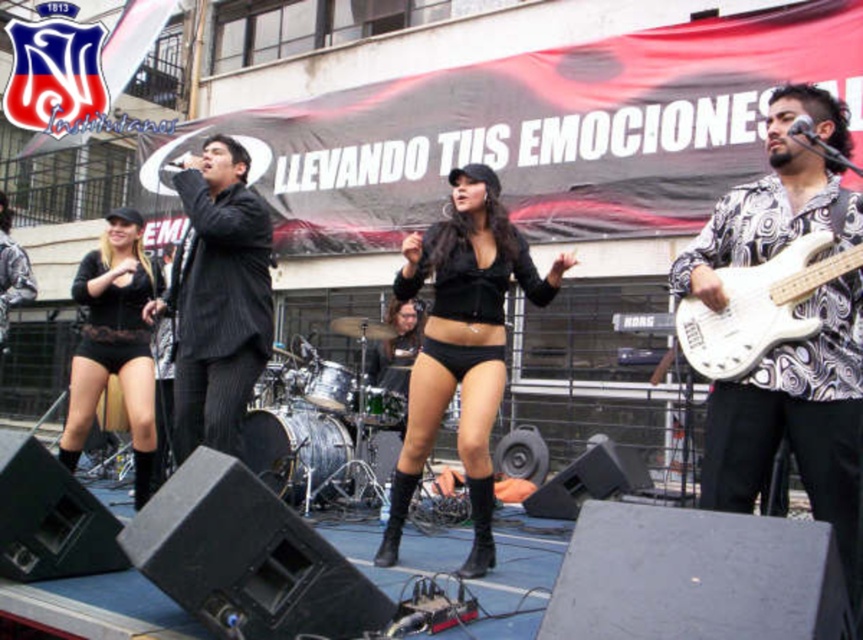
Question: Which point is closer to the camera?

Choices:
 (A) (836, 291)
 (B) (482, 252)
 (C) (213, 444)
 (D) (131, 268)

Answer: (A)

Question: Which point is farther from the camera taking this photo?

Choices:
 (A) (104, 285)
 (B) (216, 275)
 (C) (439, 410)
 (D) (720, 262)

Answer: (A)

Question: Does white paisley shirt at center have a greater width compared to black lace shorts at lower left?

Choices:
 (A) no
 (B) yes

Answer: (B)

Question: Where is black matte shorts at center located in relation to white glossy electric guitar at right in the image?

Choices:
 (A) below
 (B) above

Answer: (A)

Question: Which object is positioned closest to the white glossy electric guitar at right?

Choices:
 (A) black matte shorts at center
 (B) white paisley shirt at center
 (C) black lace shorts at lower left
 (D) black pinstripe suit at center

Answer: (B)

Question: Is white paisley shirt at center positioned before black matte shorts at center?

Choices:
 (A) no
 (B) yes

Answer: (B)